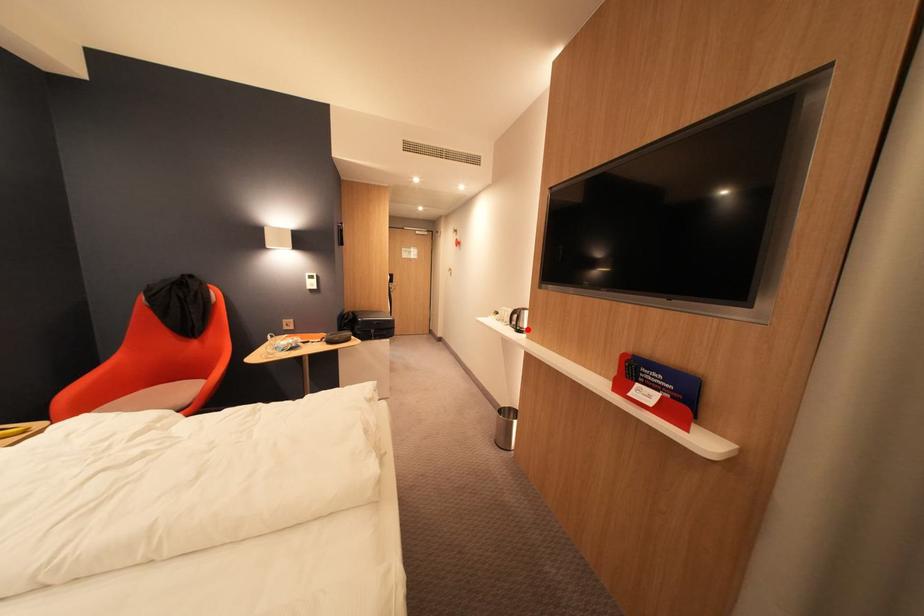
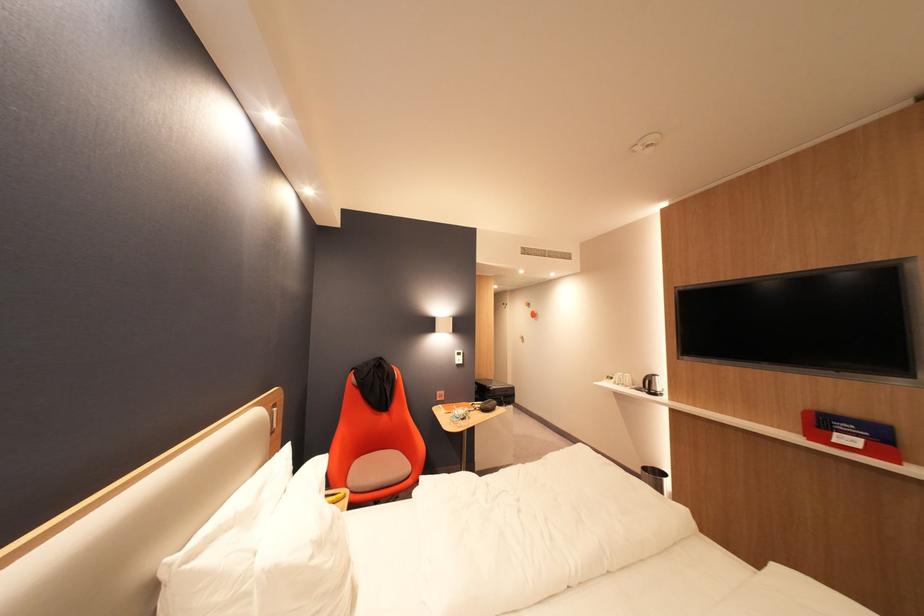
Question: I am providing you with two images of the same scene from different viewpoints. A red point is marked on the first image. Can you still see the location of the red point in image 2?

Choices:
 (A) Yes
 (B) No

Answer: (A)